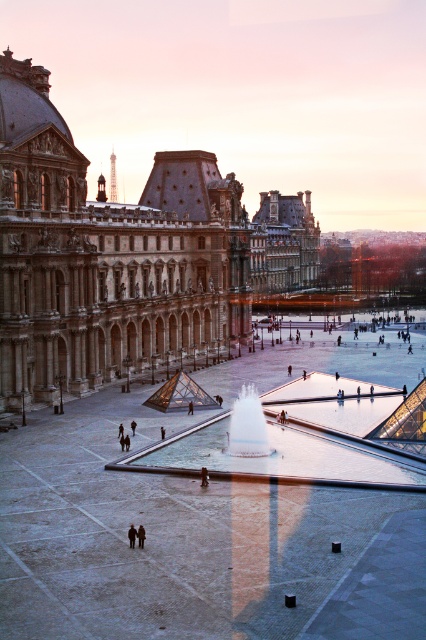
You are a GUI agent. You are given a task and a screenshot of the screen. Output one action in this format:
    pyautogui.click(x=<x>, y=<y>)
    Task: Click on the stone building at center
    The height and width of the screenshot is (640, 426).
    Given the screenshot: What is the action you would take?
    pyautogui.click(x=106, y=257)

Which of these two, stone building at center or white glossy fountain at center, stands shorter?

white glossy fountain at center

Is point (95, 220) closer to viewer compared to point (236, 429)?

That is False.

Image resolution: width=426 pixels, height=640 pixels. In order to click on stone building at center in this screenshot , I will do `click(106, 257)`.

Is the position of stone building at center less distant than that of dark brown leather coat at lower center?

No, it is not.

Does point (138, 250) lie in front of point (132, 524)?

No, it is behind (132, 524).

Locate an element on the screen. stone building at center is located at coordinates (106, 257).

From the picture: Can you confirm if brown stone building at center is positioned below white glossy fountain at center?

No, brown stone building at center is not below white glossy fountain at center.

What do you see at coordinates (284, 243) in the screenshot?
I see `brown stone building at center` at bounding box center [284, 243].

Locate an element on the screen. This screenshot has height=640, width=426. brown stone building at center is located at coordinates 284,243.